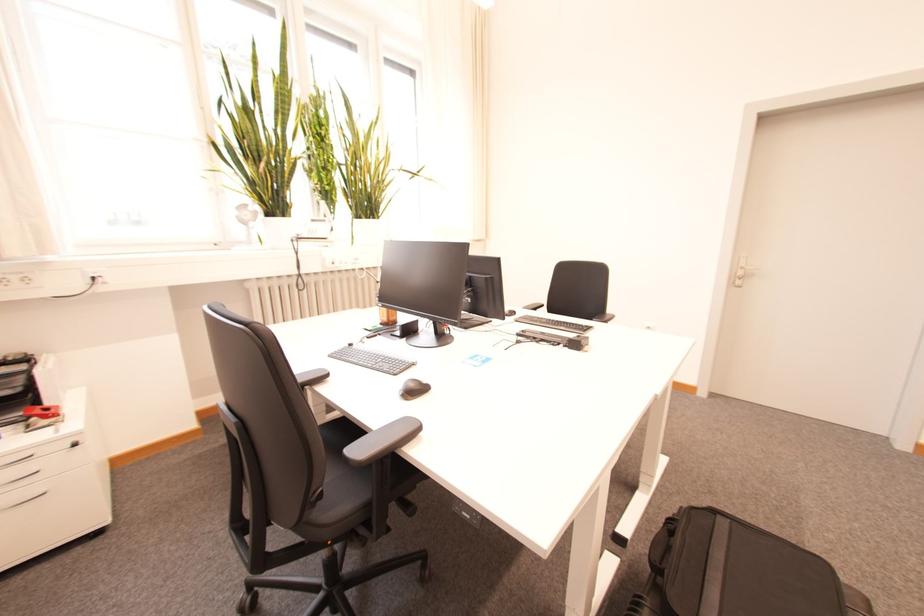
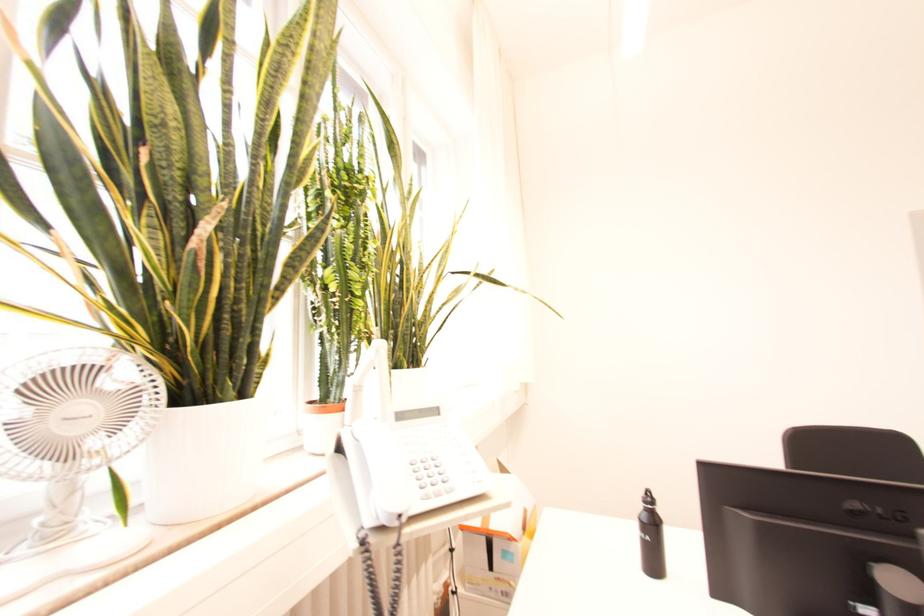
Which direction would the cameraman need to move to produce the second image?

The cameraman walked toward left, forward.